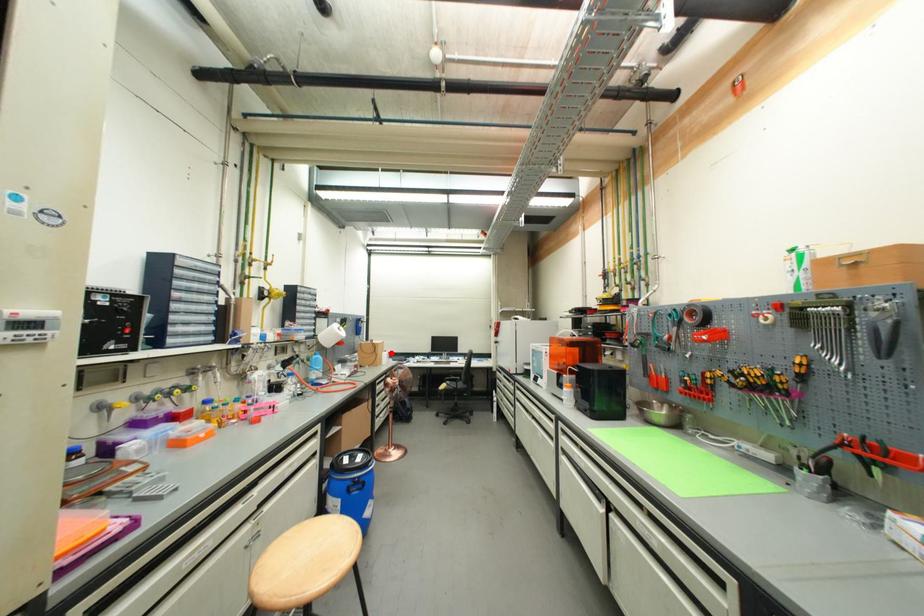
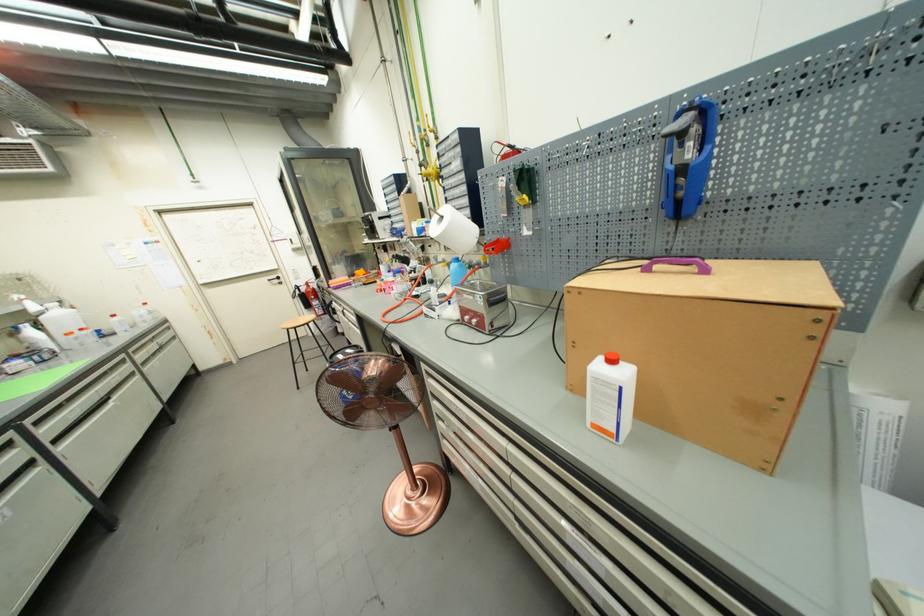
Question: I am providing you with two images of the same scene from different viewpoints. Image1 has a red point marked. In image2, the corresponding 3D location appears at what relative position? Reply with the corresponding letter.

Choices:
 (A) Closer
 (B) Farther

Answer: (B)